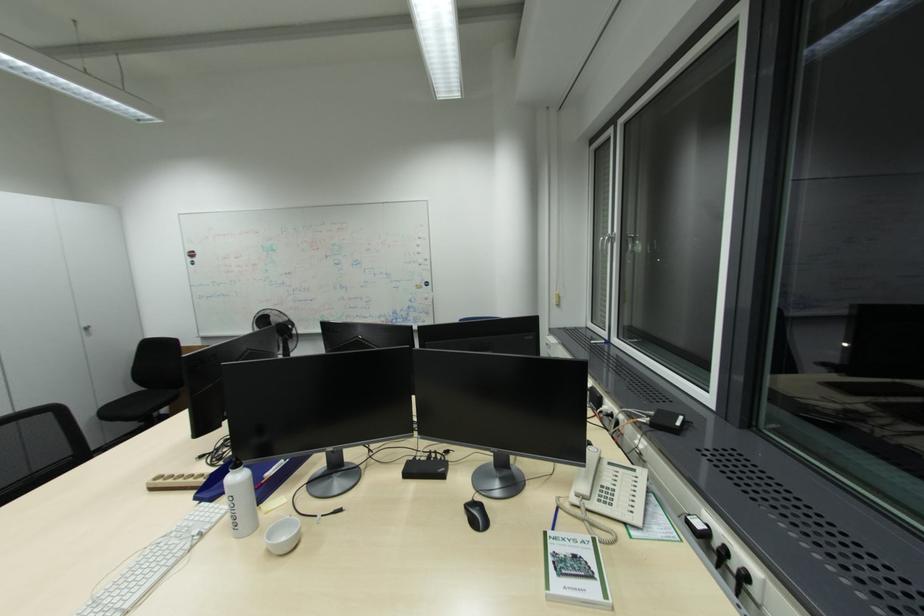
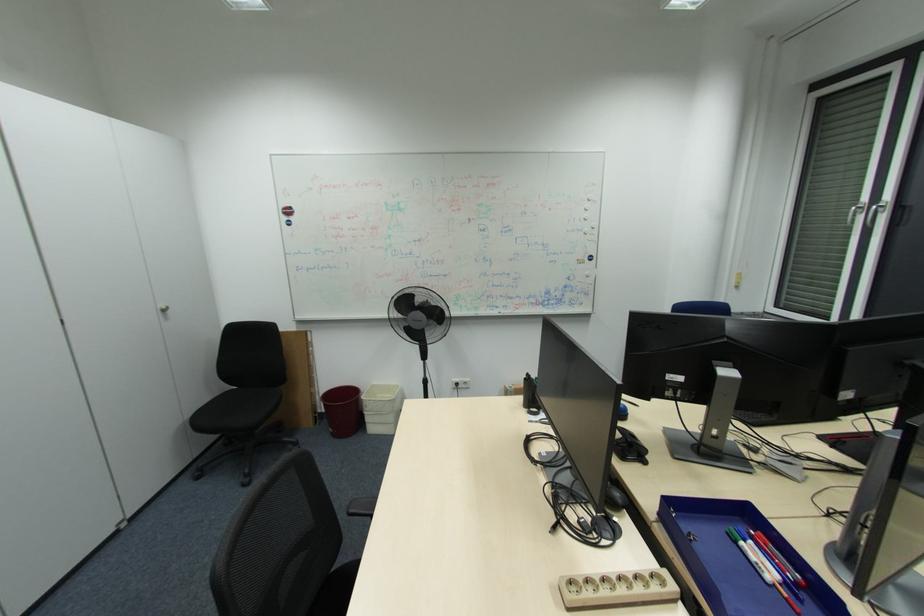
What movement of the cameraman would produce the second image?

The movement direction of the cameraman is left, forward.